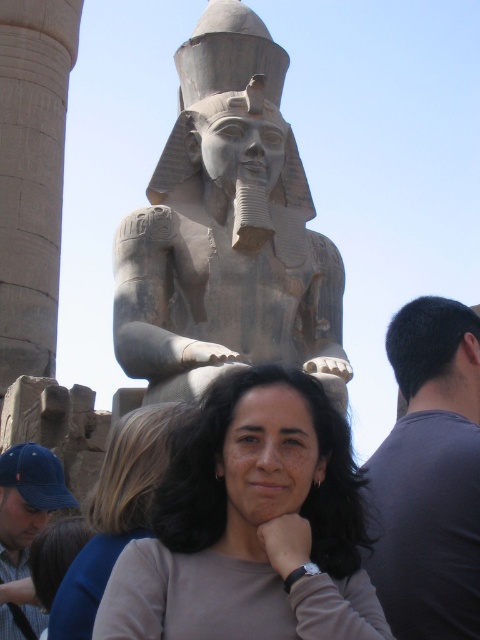
Does gray stone statue at center appear under smooth beige blouse at center?

No.

The height and width of the screenshot is (640, 480). In order to click on gray stone statue at center in this screenshot , I will do `click(227, 230)`.

Is the position of smooth stone column at left more distant than that of smooth beige blouse at center?

Yes, smooth stone column at left is further from the viewer.

Which is in front, point (36, 352) or point (90, 634)?

Point (90, 634) is more forward.

Locate an element on the screen. smooth stone column at left is located at coordinates (32, 177).

At what (x,y) coordinates should I click in order to perform the action: click on smooth stone column at left. Please return your answer as a coordinate pair (x, y). Looking at the image, I should click on (32, 177).

Who is taller, matte gray statue at center or purple fabric shirt at upper right?

purple fabric shirt at upper right is taller.

Who is higher up, matte gray statue at center or purple fabric shirt at upper right?

Positioned higher is purple fabric shirt at upper right.

Who is more forward, (x=218, y=385) or (x=422, y=342)?

Point (x=218, y=385) is in front.

Identify the location of matte gray statue at center. The height and width of the screenshot is (640, 480). (251, 524).